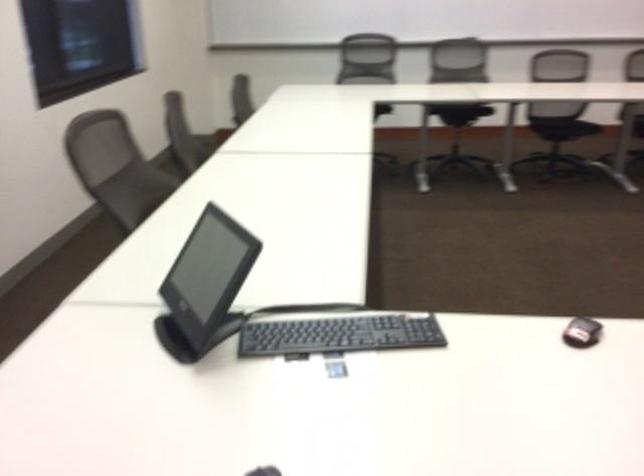
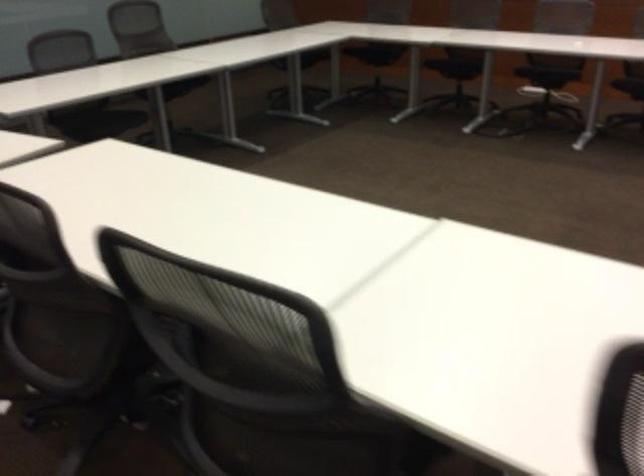
Question: What movement of the cameraman would produce the second image?

Choices:
 (A) Left
 (B) Right
 (C) Forward
 (D) Backward

Answer: (D)